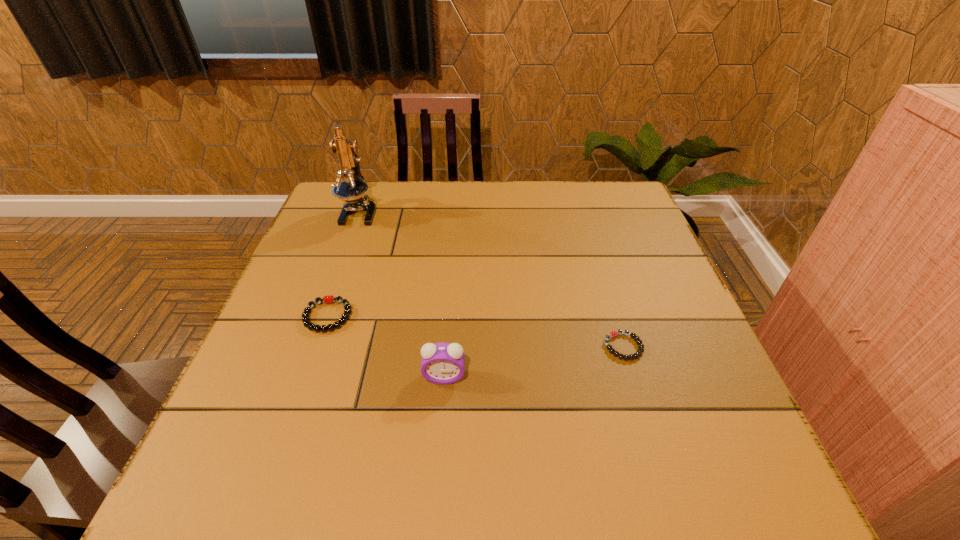
Identify the location of free space at the near left corner of the desktop. (258, 457).

The height and width of the screenshot is (540, 960). In the image, there is a desktop. In order to click on vacant space at the near right corner in this screenshot , I will do `click(703, 483)`.

Image resolution: width=960 pixels, height=540 pixels. Identify the location of free space between the nearest object and the second shortest object. (386, 347).

At what (x,y) coordinates should I click in order to perform the action: click on free spot between the second object from right to left and the microscope. Please return your answer as a coordinate pair (x, y). Looking at the image, I should click on (401, 295).

Identify the location of unoccupied position between the second object from right to left and the rightmost object. (534, 362).

Find the location of `vacant point located between the alarm clock and the rightmost object`. vacant point located between the alarm clock and the rightmost object is located at coordinates (534, 362).

Locate an element on the screen. vacant point located between the rightmost object and the third tallest object is located at coordinates (475, 332).

Find the location of a particular element. The width and height of the screenshot is (960, 540). empty space between the alarm clock and the shorter bracelet is located at coordinates (534, 362).

You are a GUI agent. You are given a task and a screenshot of the screen. Output one action in this format:
    pyautogui.click(x=<x>, y=<y>)
    Task: Click on the free space that is in between the shortest object and the nearest object
    The image size is (960, 540).
    Given the screenshot: What is the action you would take?
    pyautogui.click(x=534, y=362)

Identify the location of vacant point located between the third tallest object and the alarm clock. Image resolution: width=960 pixels, height=540 pixels. (386, 347).